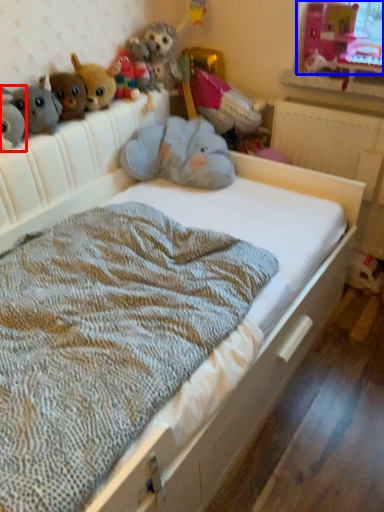
Question: Which point is closer to the camera, toy (highlighted by a red box) or window screen (highlighted by a blue box)?

Choices:
 (A) toy
 (B) window screen

Answer: (A)